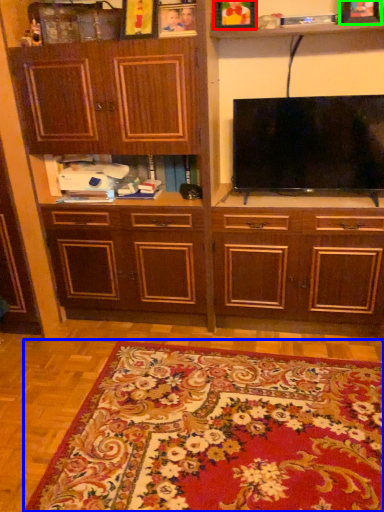
Question: Considering the real-world distances, which object is farthest from picture frame (highlighted by a red box)? mat (highlighted by a blue box) or picture frame (highlighted by a green box)?

Choices:
 (A) mat
 (B) picture frame

Answer: (A)